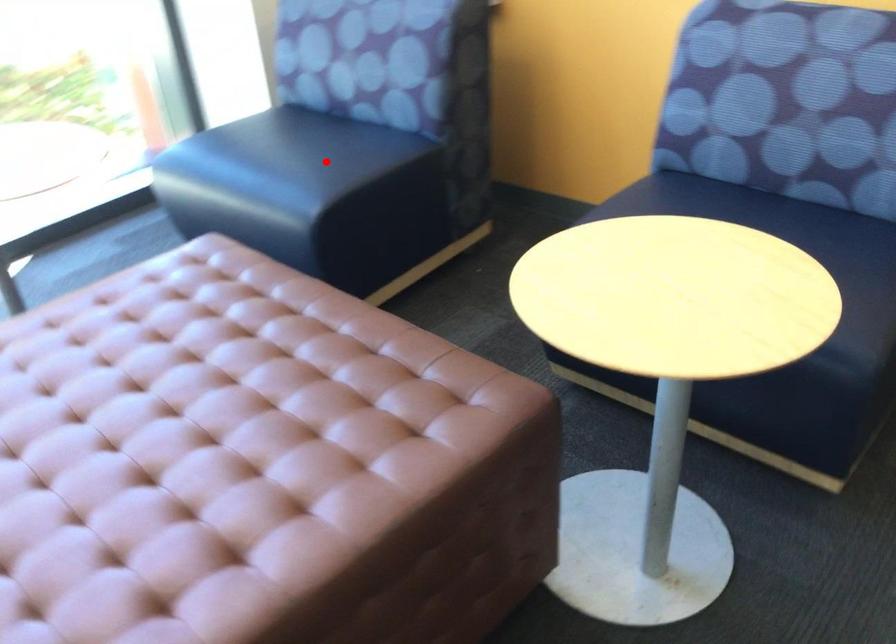
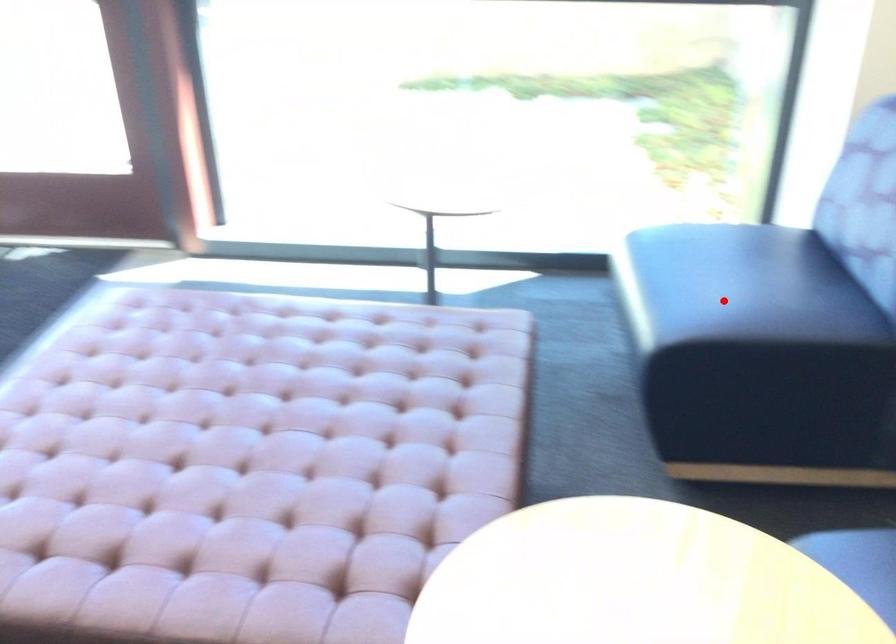
I am providing you with two images of the same scene from different viewpoints. A red point is marked on the first image and another point is marked on the second image. Is the red point in image1 aligned with the point shown in image2?

Yes